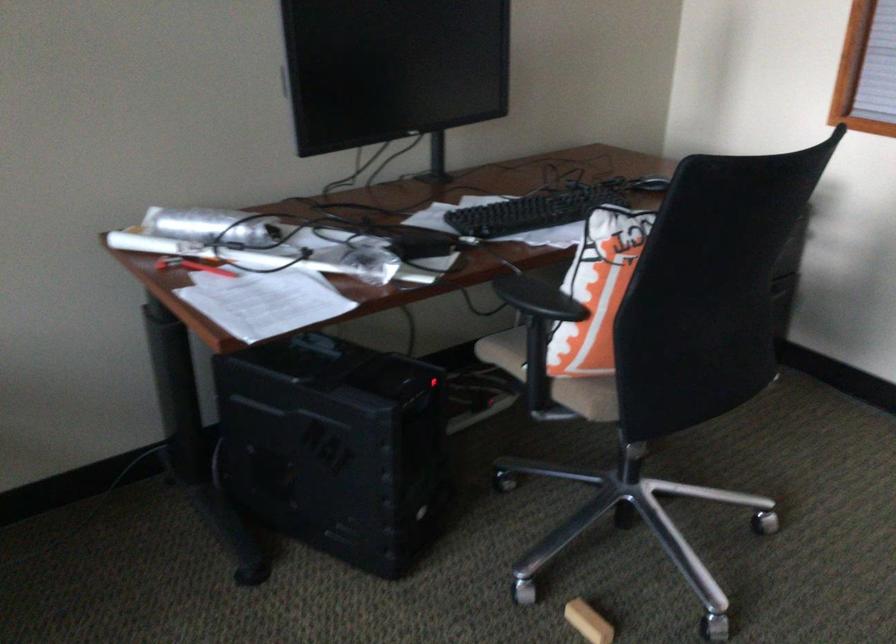
Which object does [192,266] point to?

It corresponds to the red utility knife in the image.